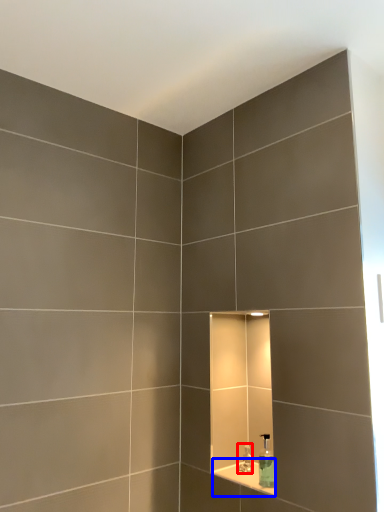
Question: Which point is closer to the camera, faucet (highlighted by a red box) or ledge (highlighted by a blue box)?

Choices:
 (A) faucet
 (B) ledge

Answer: (B)